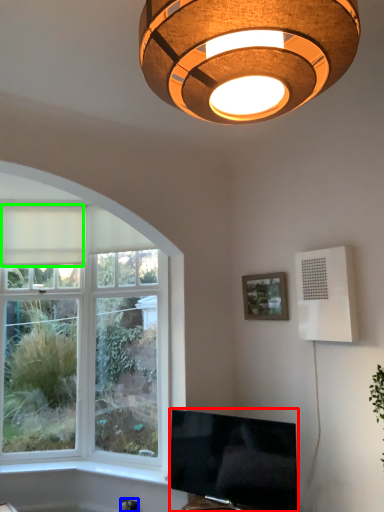
Question: Considering the real-world distances, which object is farthest from television (highlighted by a red box)? electric outlet (highlighted by a blue box) or curtain (highlighted by a green box)?

Choices:
 (A) electric outlet
 (B) curtain

Answer: (B)